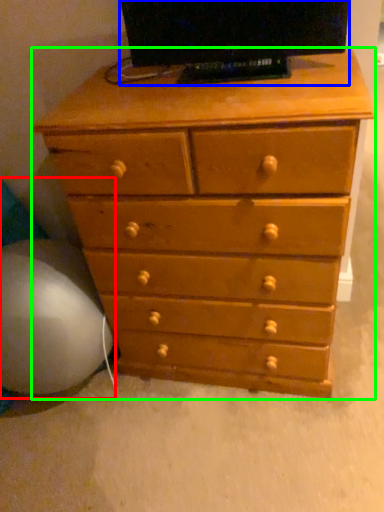
Question: Considering the real-world distances, which object is closest to bean bag chair (highlighted by a red box)? television (highlighted by a blue box) or chest of drawers (highlighted by a green box).

Choices:
 (A) television
 (B) chest of drawers

Answer: (B)